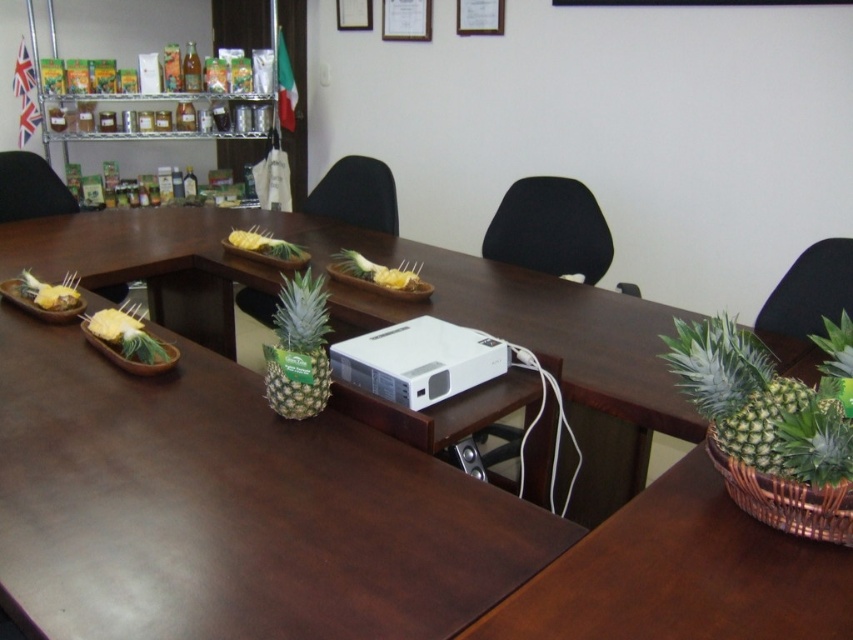
You are a guest entering the conference room and want to sit in the black leather chair at upper right. According to the room layout, where should you walk towards to reach it?

The black leather chair at upper right is located at point 0.456 on the x axis and 0.951 on the y axis, so you should walk towards the upper right direction to reach it.

You are standing at the entrance of the conference room and see the black fabric chair at center. If you want to walk directly to it, which direction should you head towards?

Since the black fabric chair at center is located at point (x=550, y=228), you should head towards the center of the room to reach it.